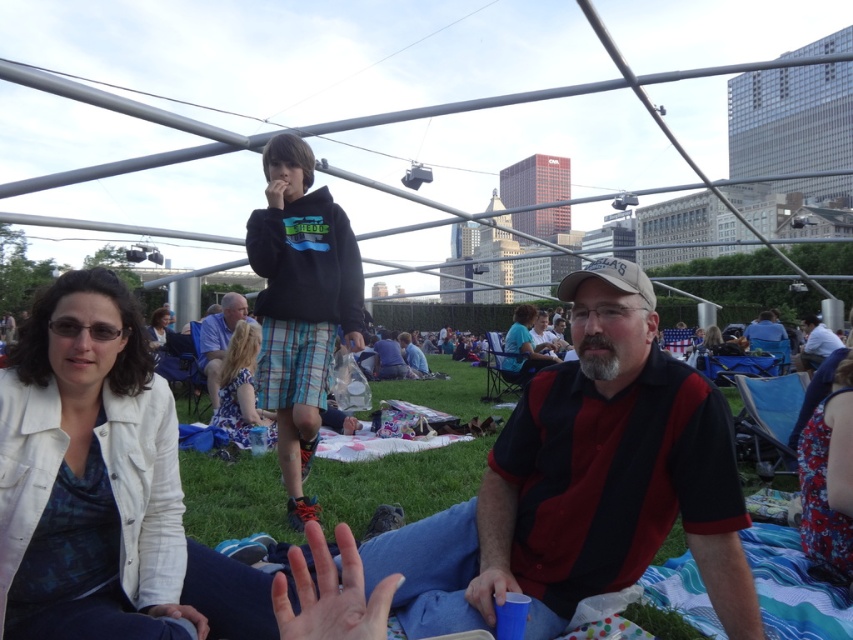
Question: Does white cotton jacket at lower left have a lesser width compared to printed cotton dress at center?

Choices:
 (A) no
 (B) yes

Answer: (A)

Question: In this image, where is printed cotton dress at center located relative to blue plaid shorts at center?

Choices:
 (A) below
 (B) above

Answer: (A)

Question: Which of the following is the closest to the observer?

Choices:
 (A) (819, 340)
 (B) (57, 595)

Answer: (B)

Question: Estimate the real-world distances between objects in this image. Which object is closer to the dark blue jeans at center?

Choices:
 (A) reddish-brown cotton polo shirt at center
 (B) white cotton shirt at center
 (C) matte blue shirt at center

Answer: (C)

Question: Among these objects, which one is farthest from the camera?

Choices:
 (A) reddish-brown cotton polo shirt at center
 (B) white cotton shirt at center

Answer: (B)

Question: Where is white cotton jacket at lower left located in relation to dark blue jeans at center in the image?

Choices:
 (A) right
 (B) left

Answer: (B)